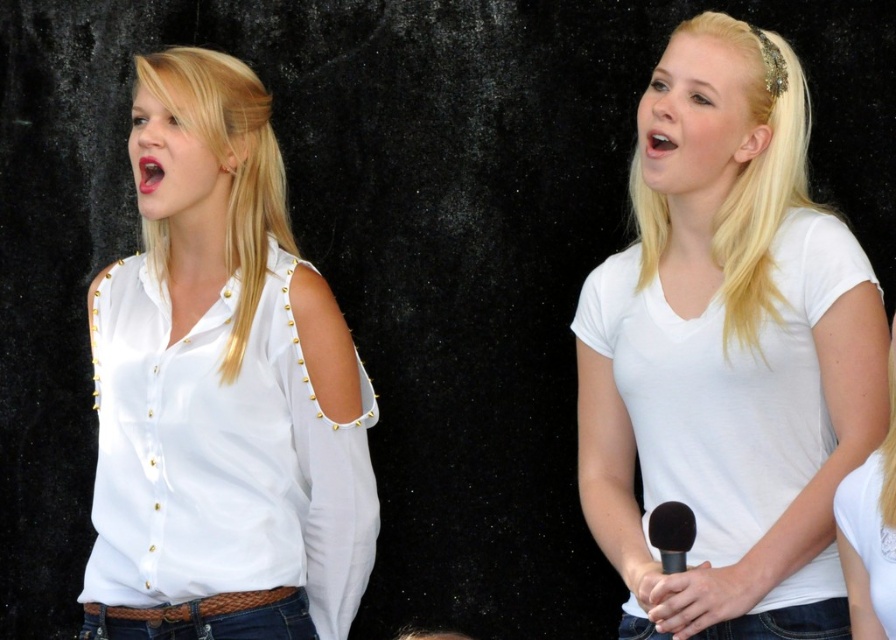
Question: Which point is farther from the camera taking this photo?

Choices:
 (A) (767, 513)
 (B) (668, 509)

Answer: (A)

Question: Is white matte shirt at center wider than white studded shirt at left?

Choices:
 (A) yes
 (B) no

Answer: (B)

Question: Observing the image, what is the correct spatial positioning of white matte shirt at center in reference to black matte microphone at lower center?

Choices:
 (A) left
 (B) right

Answer: (B)

Question: Which point appears farthest from the camera in this image?

Choices:
 (A) (649, 529)
 (B) (638, 292)

Answer: (B)

Question: Is white matte shirt at center positioned at the back of white studded shirt at left?

Choices:
 (A) no
 (B) yes

Answer: (A)

Question: Which of these objects is positioned closest to the white matte shirt at center?

Choices:
 (A) black matte microphone at lower center
 (B) white studded shirt at left

Answer: (A)